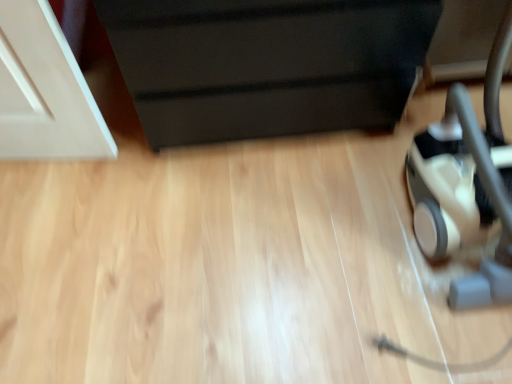
Locate an element on the screen. This screenshot has height=384, width=512. vacant area that lies in front of black matte drawer at upper center is located at coordinates (253, 242).